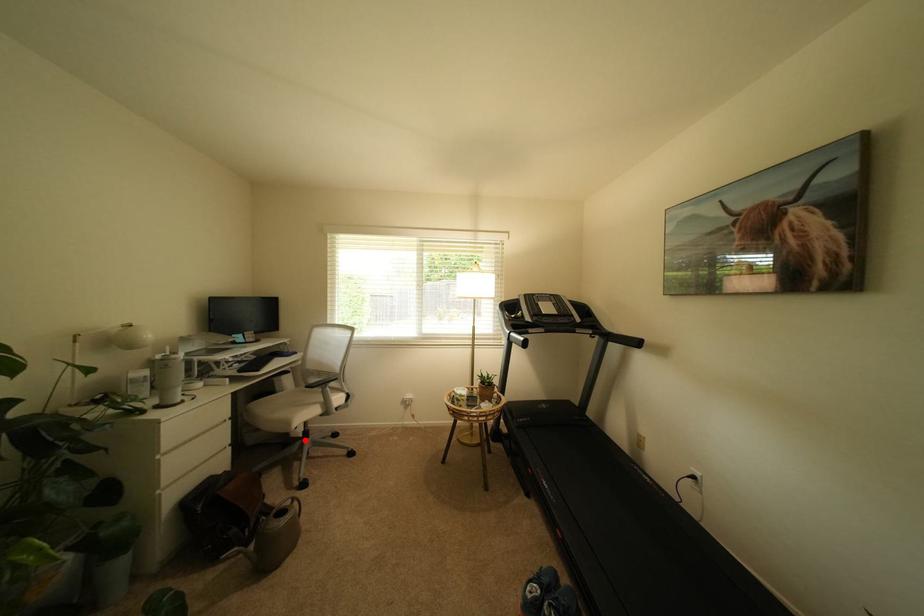
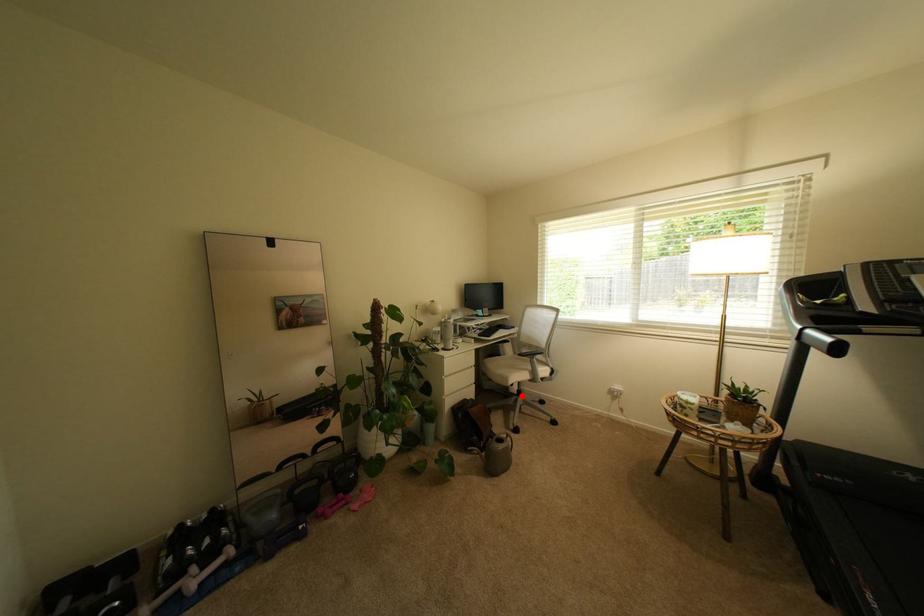
I am providing you with two images of the same scene from different viewpoints. A red point is marked on the first image and another point is marked on the second image. Do the highlighted points in image1 and image2 indicate the same real-world spot?

Yes